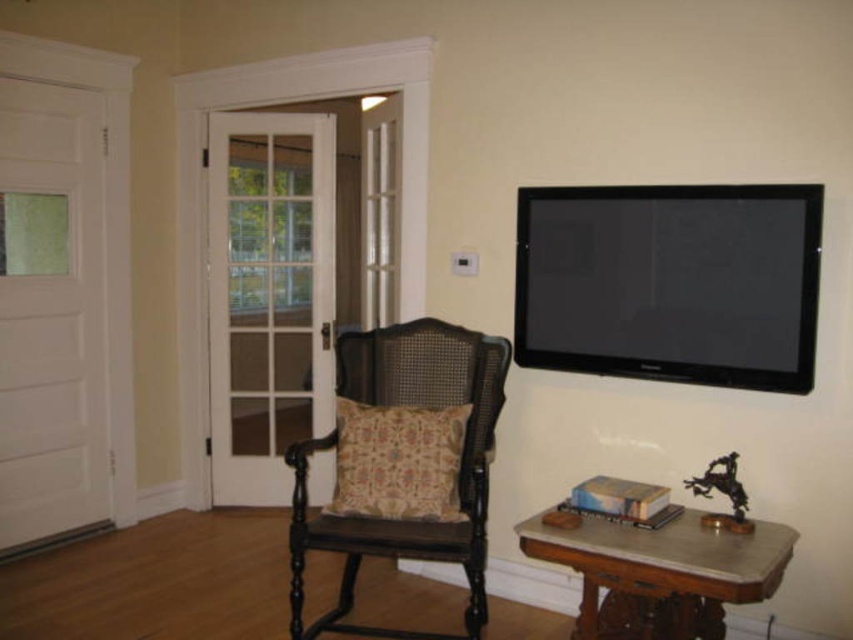
Question: Where is flat screen tv at upper right located in relation to matte black wooden rocking chair at center in the image?

Choices:
 (A) right
 (B) left

Answer: (A)

Question: Among these objects, which one is nearest to the camera?

Choices:
 (A) flat screen tv at upper right
 (B) matte black wooden rocking chair at center

Answer: (A)

Question: Can you confirm if matte black wooden rocking chair at center is smaller than brown wood table at lower right?

Choices:
 (A) yes
 (B) no

Answer: (B)

Question: Can you confirm if flat screen tv at upper right is thinner than brown wood table at lower right?

Choices:
 (A) no
 (B) yes

Answer: (B)

Question: Which of these objects is positioned closest to the matte black wooden rocking chair at center?

Choices:
 (A) brown wood table at lower right
 (B) flat screen tv at upper right

Answer: (A)

Question: Which point is closer to the camera?

Choices:
 (A) (425, 401)
 (B) (764, 556)
 (C) (547, 294)

Answer: (B)